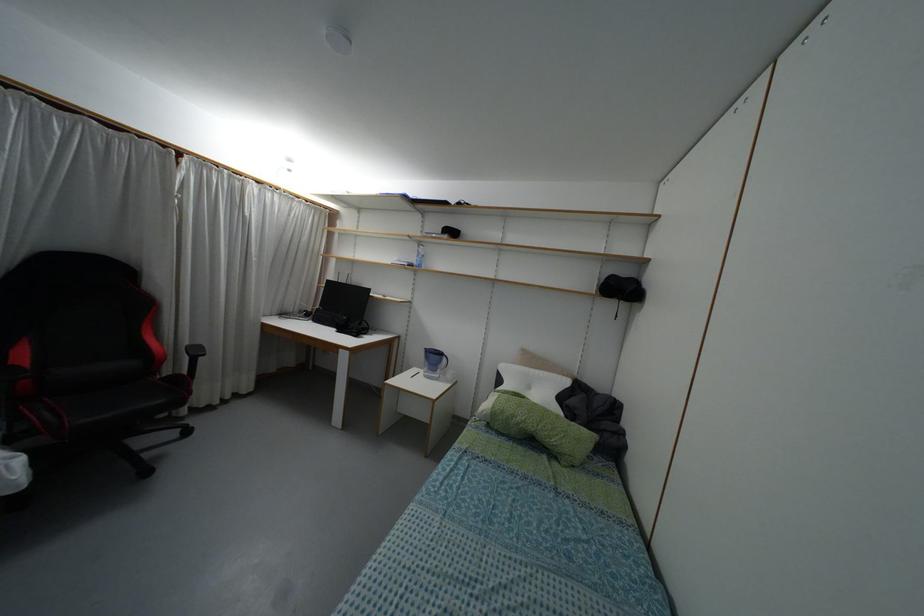
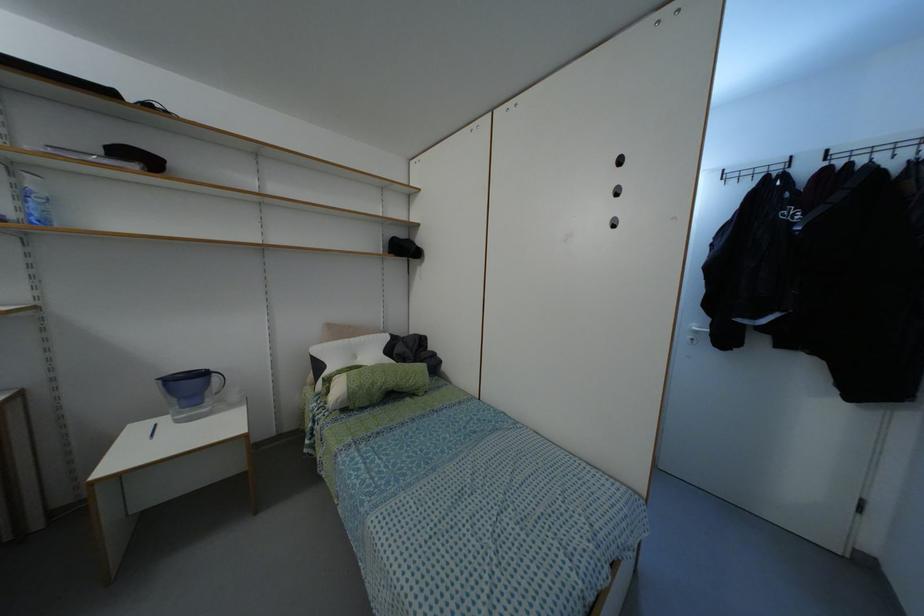
Where in the second image is the point corresponding to pixel 444 359 from the first image?

(214, 378)